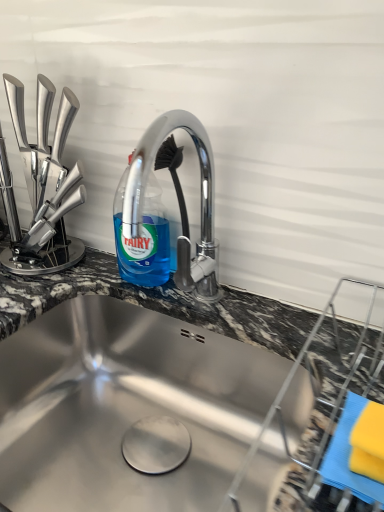
Describe the element at coordinates (124, 406) in the screenshot. I see `stainless steel sink at center` at that location.

You are a GUI agent. You are given a task and a screenshot of the screen. Output one action in this format:
    pyautogui.click(x=<x>, y=<y>)
    Task: Click on the stainless steel sink at center
    The width and height of the screenshot is (384, 512).
    Given the screenshot: What is the action you would take?
    pyautogui.click(x=124, y=406)

Measure the distance between stainless steel sink at center and camera.

stainless steel sink at center is 60.18 centimeters away from camera.

Describe the element at coordinates (143, 238) in the screenshot. This screenshot has height=512, width=384. I see `blue translucent liquid at upper center` at that location.

Where is `blue translucent liquid at upper center`? The image size is (384, 512). blue translucent liquid at upper center is located at coordinates (143, 238).

This screenshot has height=512, width=384. I want to click on stainless steel sink at center, so click(124, 406).

Which is more to the right, stainless steel sink at center or blue translucent liquid at upper center?

From the viewer's perspective, stainless steel sink at center appears more on the right side.

In the scene shown: In the image, is stainless steel sink at center positioned in front of or behind blue translucent liquid at upper center?

stainless steel sink at center is positioned closer to the viewer than blue translucent liquid at upper center.

Is point (159, 343) behind point (146, 272)?

Yes, point (159, 343) is behind point (146, 272).

From the image's perspective, which is above, stainless steel sink at center or blue translucent liquid at upper center?

blue translucent liquid at upper center.

From a real-world perspective, between stainless steel sink at center and blue translucent liquid at upper center, who is vertically lower?

stainless steel sink at center is physically lower.

Can you confirm if stainless steel sink at center is thinner than blue translucent liquid at upper center?

Incorrect, the width of stainless steel sink at center is not less than that of blue translucent liquid at upper center.

Based on the photo, can you confirm if stainless steel sink at center is taller than blue translucent liquid at upper center?

Incorrect, the height of stainless steel sink at center is not larger of that of blue translucent liquid at upper center.

Who is bigger, stainless steel sink at center or blue translucent liquid at upper center?

Bigger between the two is stainless steel sink at center.

Looking at this image, is stainless steel sink at center spatially inside blue translucent liquid at upper center, or outside of it?

stainless steel sink at center cannot be found inside blue translucent liquid at upper center.

From the picture: Can you see stainless steel sink at center touching blue translucent liquid at upper center?

stainless steel sink at center and blue translucent liquid at upper center are not in contact.

Is stainless steel sink at center facing away from blue translucent liquid at upper center?

stainless steel sink at center is not turned away from blue translucent liquid at upper center.

How much distance is there between stainless steel sink at center and blue translucent liquid at upper center?

21.69 centimeters.

The height and width of the screenshot is (512, 384). What are the coordinates of `bottle behind the stainless steel sink at center` in the screenshot? It's located at (143, 238).

Visually, is blue translucent liquid at upper center positioned to the left or to the right of stainless steel sink at center?

blue translucent liquid at upper center is positioned on stainless steel sink at center's left side.

Considering their positions, is blue translucent liquid at upper center located in front of or behind stainless steel sink at center?

Visually, blue translucent liquid at upper center is located behind stainless steel sink at center.

Considering the positions of point (147, 251) and point (20, 471), is point (147, 251) closer or farther from the camera than point (20, 471)?

Point (147, 251) appears to be farther away from the viewer than point (20, 471).

From the image's perspective, between blue translucent liquid at upper center and stainless steel sink at center, which one is located above?

blue translucent liquid at upper center appears higher in the image.

From a real-world perspective, relative to stainless steel sink at center, is blue translucent liquid at upper center vertically above or below?

From a real-world perspective, blue translucent liquid at upper center is physically above stainless steel sink at center.

Can you confirm if blue translucent liquid at upper center is wider than stainless steel sink at center?

No.

Consider the image. Who is shorter, blue translucent liquid at upper center or stainless steel sink at center?

Standing shorter between the two is stainless steel sink at center.

Does blue translucent liquid at upper center have a smaller size compared to stainless steel sink at center?

Yes.

Is blue translucent liquid at upper center completely or partially outside of stainless steel sink at center?

Yes, blue translucent liquid at upper center is located beyond the bounds of stainless steel sink at center.

Is blue translucent liquid at upper center not close to stainless steel sink at center?

blue translucent liquid at upper center is actually quite close to stainless steel sink at center.

Could you tell me if blue translucent liquid at upper center is facing stainless steel sink at center?

No, blue translucent liquid at upper center is not turned towards stainless steel sink at center.

How many degrees apart are the facing directions of blue translucent liquid at upper center and stainless steel sink at center?

blue translucent liquid at upper center and stainless steel sink at center are facing 0.00294 degrees away from each other.

How much distance is there between blue translucent liquid at upper center and stainless steel sink at center?

They are 8.54 inches apart.

This screenshot has height=512, width=384. Find the location of `bottle to the left of stainless steel sink at center`. bottle to the left of stainless steel sink at center is located at coordinates pyautogui.click(x=143, y=238).

In order to click on bottle that is above the stainless steel sink at center (from a real-world perspective) in this screenshot , I will do `click(143, 238)`.

This screenshot has height=512, width=384. I want to click on sink that appears in front of the blue translucent liquid at upper center, so click(x=124, y=406).